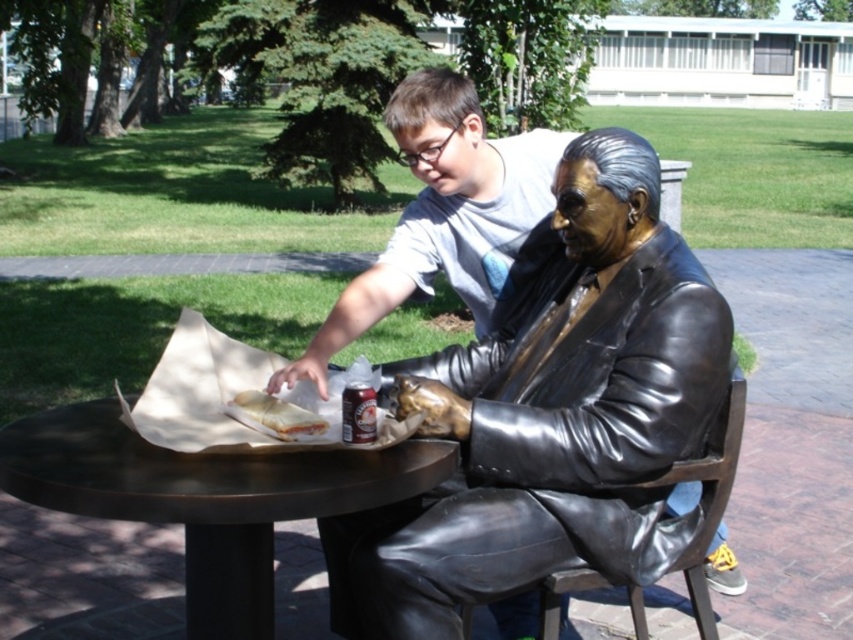
Question: Does bronze metallic table at center come behind white bread at center?

Choices:
 (A) no
 (B) yes

Answer: (A)

Question: Which of these objects is positioned farthest from the bronze statue at center?

Choices:
 (A) white bread at center
 (B) metallic silver can at table

Answer: (A)

Question: Among these points, which one is farthest from the camera?

Choices:
 (A) (372, 429)
 (B) (294, 422)

Answer: (B)

Question: Can you confirm if bronze statue at center is positioned below bronze metallic table at center?

Choices:
 (A) no
 (B) yes

Answer: (A)

Question: Does bronze statue at center lie in front of white bread at center?

Choices:
 (A) yes
 (B) no

Answer: (A)

Question: Which of these objects is positioned closest to the white bread at center?

Choices:
 (A) bronze metallic table at center
 (B) metallic silver can at table

Answer: (B)